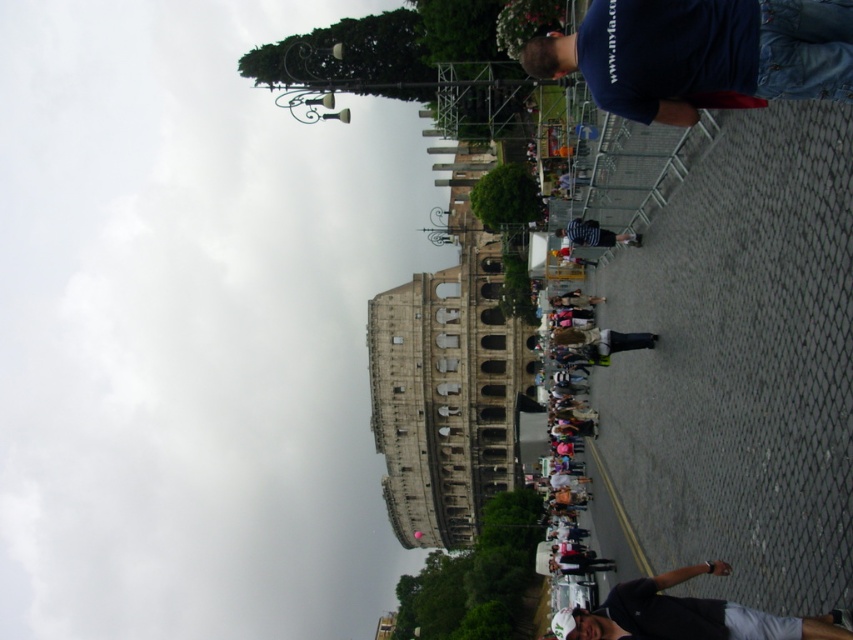
In the scene shown: Who is positioned more to the left, dark blue t-shirt at upper right or gray cotton t-shirt at lower right?

From the viewer's perspective, dark blue t-shirt at upper right appears more on the left side.

Does dark blue t-shirt at upper right appear over gray cotton t-shirt at lower right?

Correct, dark blue t-shirt at upper right is located above gray cotton t-shirt at lower right.

Where is `dark blue t-shirt at upper right`? This screenshot has width=853, height=640. dark blue t-shirt at upper right is located at coordinates (700, 52).

Based on the photo, is gray cotton t-shirt at lower right wider than striped cotton shirt at center?

Correct, the width of gray cotton t-shirt at lower right exceeds that of striped cotton shirt at center.

Does gray cotton t-shirt at lower right have a lesser height compared to striped cotton shirt at center?

Incorrect, gray cotton t-shirt at lower right's height does not fall short of striped cotton shirt at center's.

Between point (738, 616) and point (605, 228), which one is positioned behind?

The point (605, 228) is more distant.

Locate an element on the screen. gray cotton t-shirt at lower right is located at coordinates (685, 614).

Which is more to the right, dark blue t-shirt at upper right or striped cotton shirt at center?

striped cotton shirt at center

What do you see at coordinates (700, 52) in the screenshot? The height and width of the screenshot is (640, 853). I see `dark blue t-shirt at upper right` at bounding box center [700, 52].

Which is in front, point (763, 42) or point (630, 232)?

Point (763, 42)

This screenshot has height=640, width=853. In order to click on dark blue t-shirt at upper right in this screenshot , I will do `click(700, 52)`.